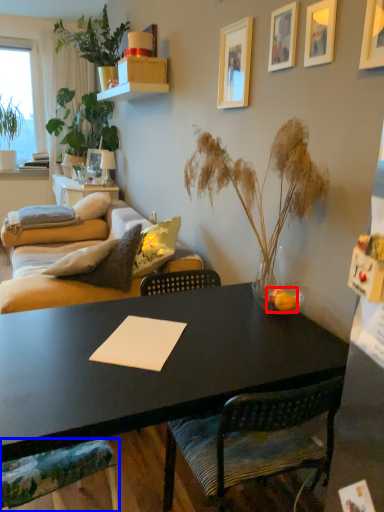
Question: Which of the following is the farthest to the observer, fruit (highlighted by a red box) or chair (highlighted by a blue box)?

Choices:
 (A) fruit
 (B) chair

Answer: (A)